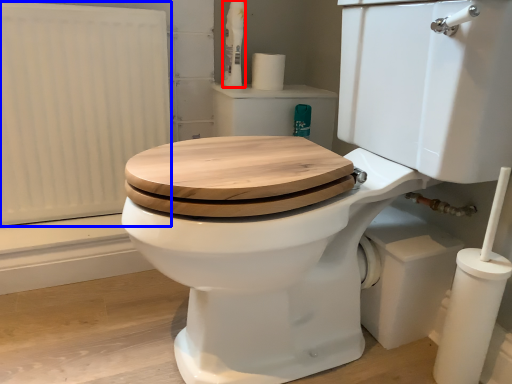
Question: Which object is closer to the camera taking this photo, toiletry (highlighted by a red box) or radiator (highlighted by a blue box)?

Choices:
 (A) toiletry
 (B) radiator

Answer: (B)